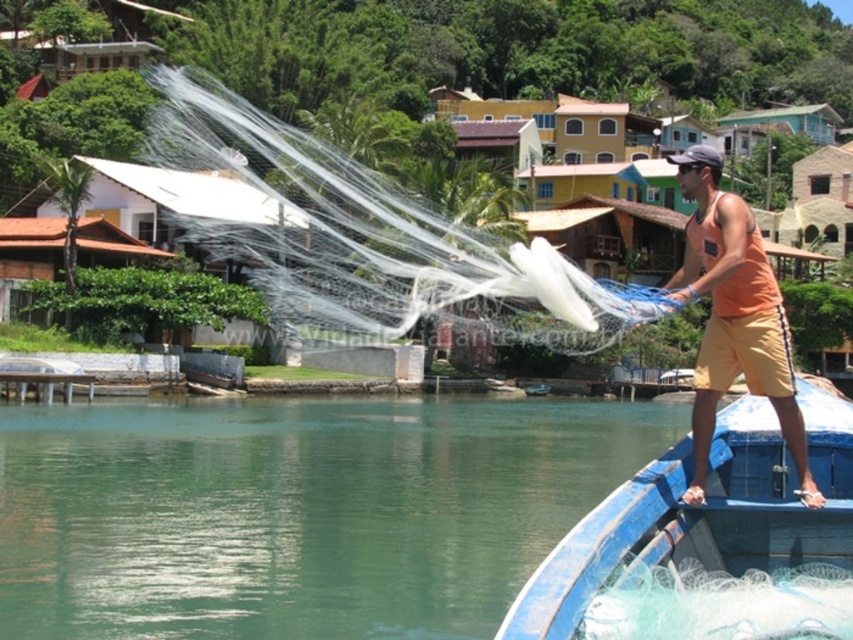
You are a drone operator trying to capture a photo of the orange cotton tank top at right and the transparent nylon fishing net at center. The drone can only focus on objects within a 30 meter range. Will both objects be in focus at the same time?

The distance between the transparent nylon fishing net at center and orange cotton tank top at right is 28.73 meters, which is within the 30 meter range. Therefore, the drone can focus on both objects simultaneously.

You are a tourist standing on the beach and see the blue painted wood boat at right and the green translucent water at lower left. Which object is closer to you?

The green translucent water at lower left is closer to you because the blue painted wood boat at right is behind it.